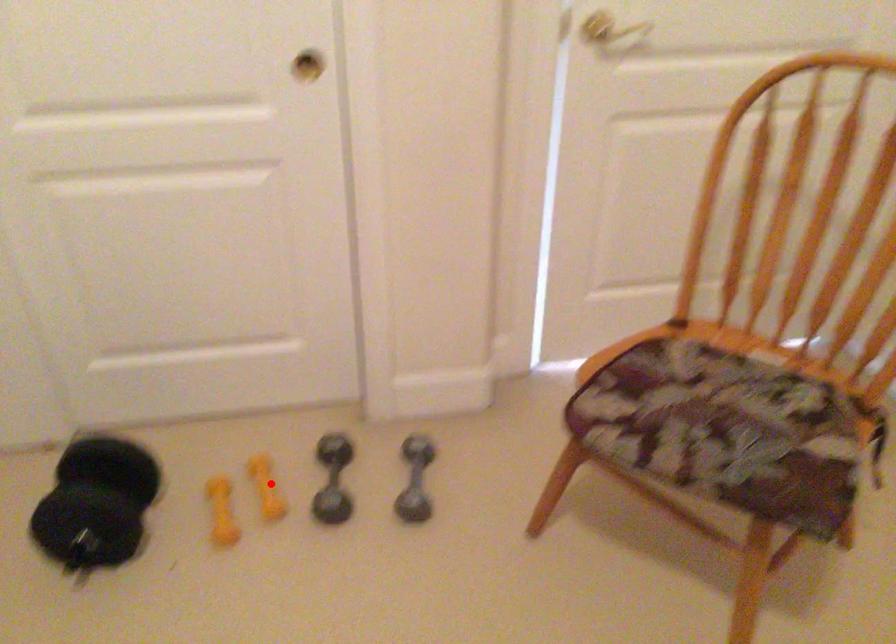
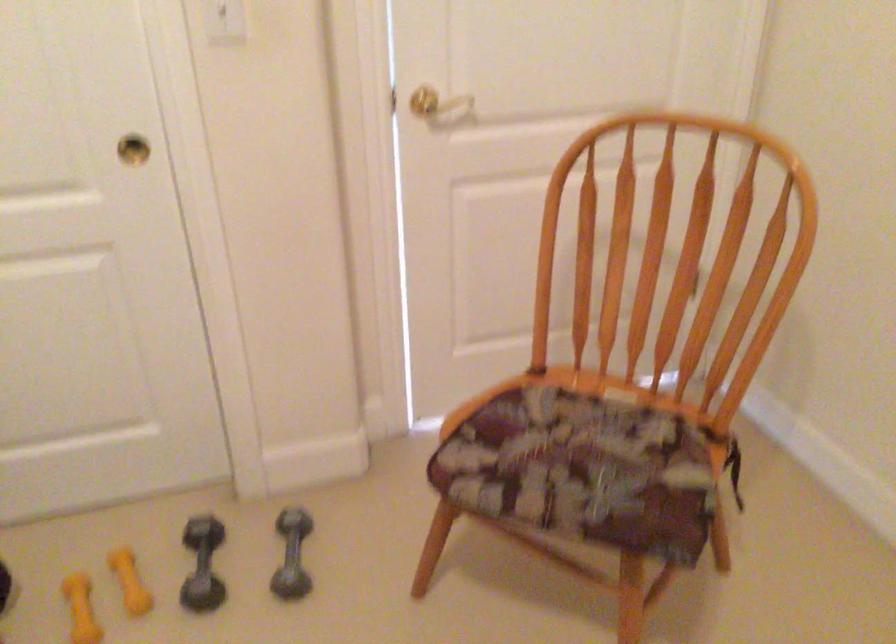
Where in the second image is the point corresponding to the highlighted location from the first image?

(128, 581)